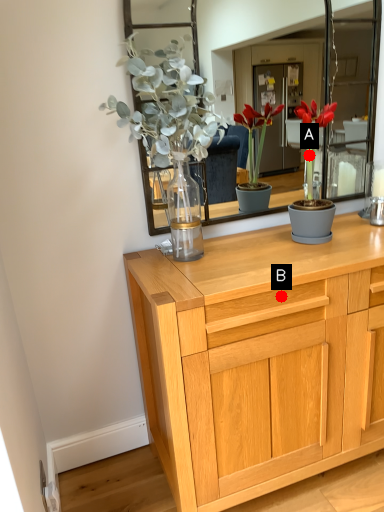
Question: Two points are circled on the image, labeled by A and B beside each circle. Which point appears farthest from the camera in this image?

Choices:
 (A) A is further
 (B) B is further

Answer: (A)